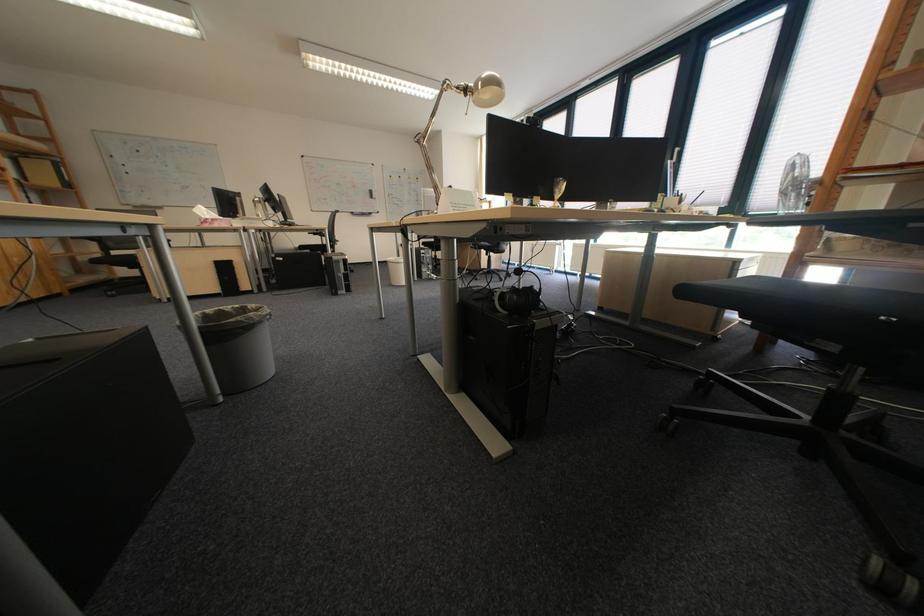
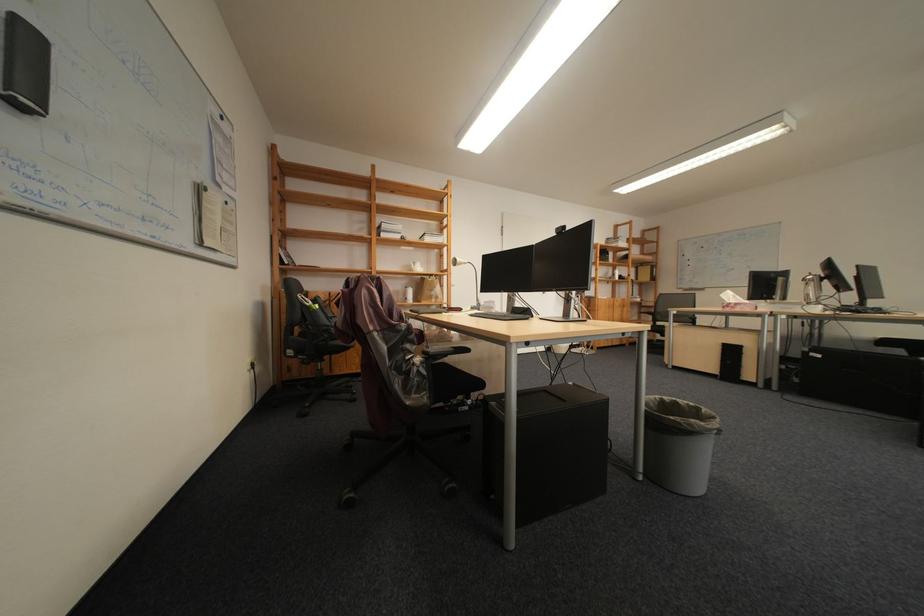
In the second image, find the point that corresponds to (225,225) in the first image.

(747, 309)